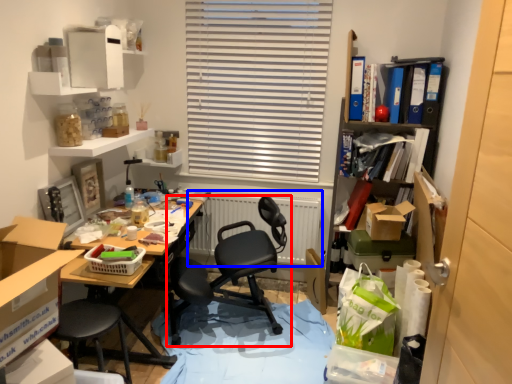
Question: Which point is further to the camera, chair (highlighted by a red box) or radiator (highlighted by a blue box)?

Choices:
 (A) chair
 (B) radiator

Answer: (B)